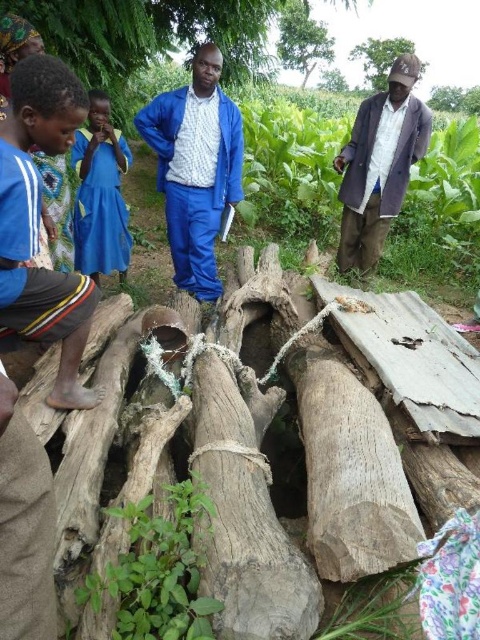
You are a gardener standing in the middle of the scene. You need to place a new flowerpot between the gray rough tree trunk at center and the green leafy tree at upper center. Which direction should you move to place it between them?

The gray rough tree trunk at center is positioned under the green leafy tree at upper center, so you should move upward from the gray rough tree trunk at center towards the green leafy tree at upper center to place the flowerpot between them.

Looking at this image, you are standing in the rural outdoor setting described. You need to find the blue fabric shirt at left. According to the coordinates provided in the Objects Description, where should you look relative to the pile of logs?

The blue fabric shirt at left is located at point coordinates (37, 224), which is to the left side of the pile of logs.